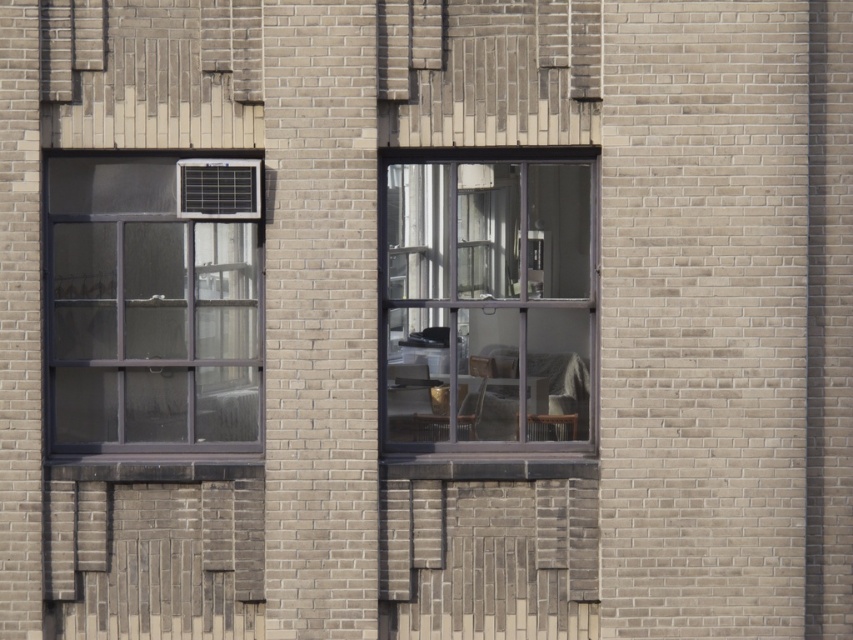
Question: Which point is farther from the camera taking this photo?

Choices:
 (A) (186, 268)
 (B) (462, 397)

Answer: (B)

Question: Observing the image, what is the correct spatial positioning of clear glass window at left in reference to clear glass window at center?

Choices:
 (A) above
 (B) below

Answer: (A)

Question: Which point is farther to the camera?

Choices:
 (A) clear glass window at center
 (B) clear glass window at left

Answer: (A)

Question: Is clear glass window at left smaller than clear glass window at center?

Choices:
 (A) no
 (B) yes

Answer: (A)

Question: Observing the image, what is the correct spatial positioning of clear glass window at left in reference to clear glass window at center?

Choices:
 (A) right
 (B) left

Answer: (B)